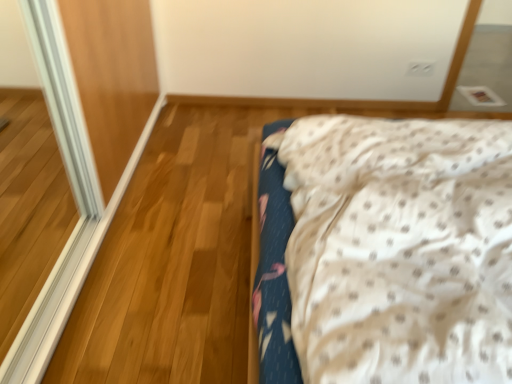
Measure the distance between white dotted fabric at center and camera.

26.03 inches.

Where is `white dotted fabric at center`? white dotted fabric at center is located at coordinates (399, 248).

What is the approximate height of white dotted fabric at center?

white dotted fabric at center is 13.24 inches in height.

The width and height of the screenshot is (512, 384). Describe the element at coordinates (399, 248) in the screenshot. I see `white dotted fabric at center` at that location.

Locate an element on the screen. white dotted fabric at center is located at coordinates (399, 248).